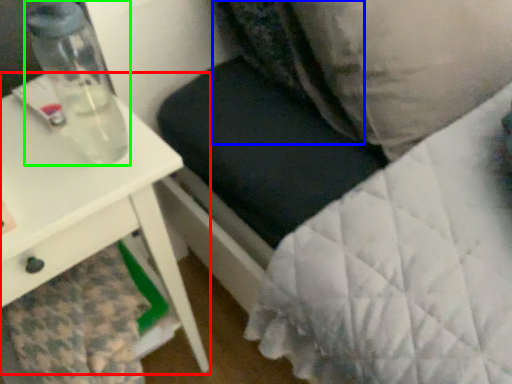
Question: Estimate the real-world distances between objects in this image. Which object is farther from table (highlighted by a red box), pillow (highlighted by a blue box) or bottle (highlighted by a green box)?

Choices:
 (A) pillow
 (B) bottle

Answer: (A)